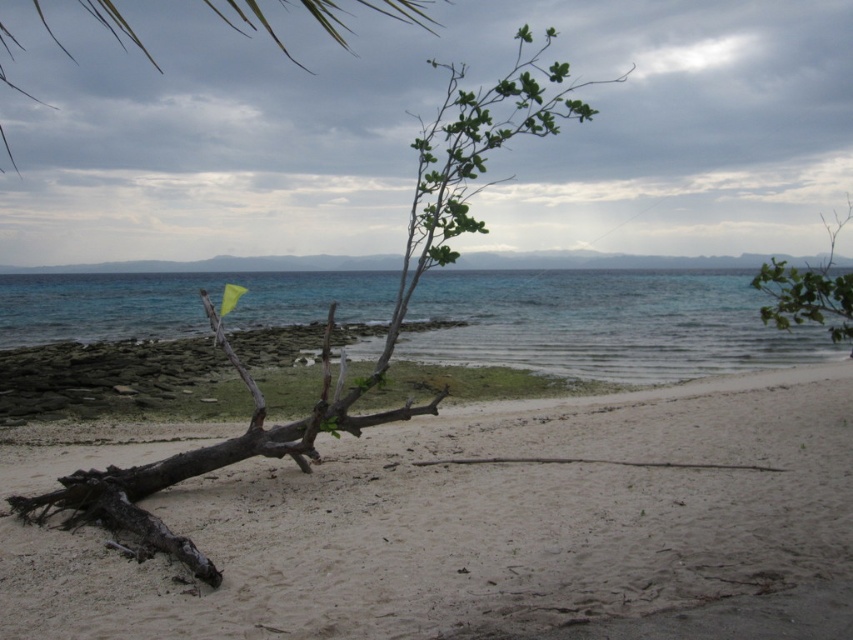
Question: Which point appears closest to the camera in this image?

Choices:
 (A) (489, 314)
 (B) (490, 182)
 (C) (791, 291)

Answer: (B)

Question: Can you confirm if brown sandy beach at lower left is positioned above green leafy branch at upper right?

Choices:
 (A) yes
 (B) no

Answer: (B)

Question: Which object is farther from the camera taking this photo?

Choices:
 (A) brown rough wood at center
 (B) green leafy branch at upper center
 (C) brown sandy beach at lower left
 (D) green leafy branch at upper right

Answer: (C)

Question: Is brown sandy beach at lower left positioned behind clear blue water at center?

Choices:
 (A) no
 (B) yes

Answer: (A)

Question: Which of the following is the closest to the observer?

Choices:
 (A) brown sandy beach at lower left
 (B) green leafy branch at upper right
 (C) green leafy branch at upper center
 (D) clear blue water at center

Answer: (C)

Question: Considering the relative positions of clear blue water at center and brown rough wood at center in the image provided, where is clear blue water at center located with respect to brown rough wood at center?

Choices:
 (A) left
 (B) right

Answer: (A)